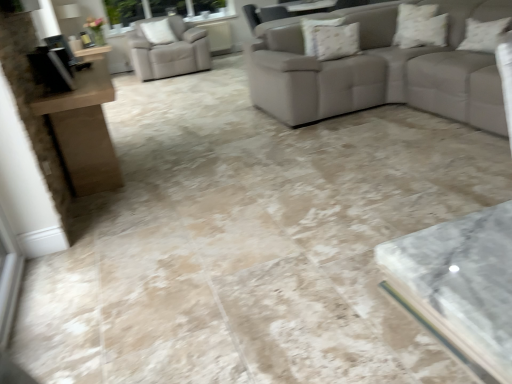
Question: Does point (480, 23) appear closer or farther from the camera than point (151, 29)?

Choices:
 (A) closer
 (B) farther

Answer: (A)

Question: Considering their positions, is white textured pillow at upper right, the 4th pillow positioned from the back, located in front of or behind white textured pillow at upper left, positioned as the 1th pillow in left-to-right order?

Choices:
 (A) front
 (B) behind

Answer: (A)

Question: Which of these objects is positioned closest to the white textured pillow at upper right, arranged as the second pillow when viewed from the top?

Choices:
 (A) white textured pillow at upper left, placed as the fourth pillow when sorted from bottom to top
 (B) beige leather armchair at upper left
 (C) floral fabric pillow at upper center, which is the 2th pillow in left-to-right order
 (D) white textured pillow at upper right, the fourth pillow positioned from the top

Answer: (D)

Question: Which is farther from the white textured pillow at upper left, the fourth pillow positioned from the right?

Choices:
 (A) white textured pillow at upper right, positioned as the first pillow in front-to-back order
 (B) beige leather armchair at upper left
 (C) floral fabric pillow at upper center, the 3th pillow positioned from the top
 (D) white textured pillow at upper right, which is the 3th pillow from bottom to top

Answer: (A)